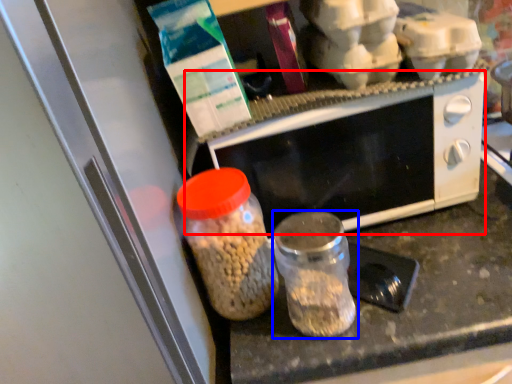
Question: Which point is further to the camera, microwave oven (highlighted by a red box) or bottle (highlighted by a blue box)?

Choices:
 (A) microwave oven
 (B) bottle

Answer: (A)